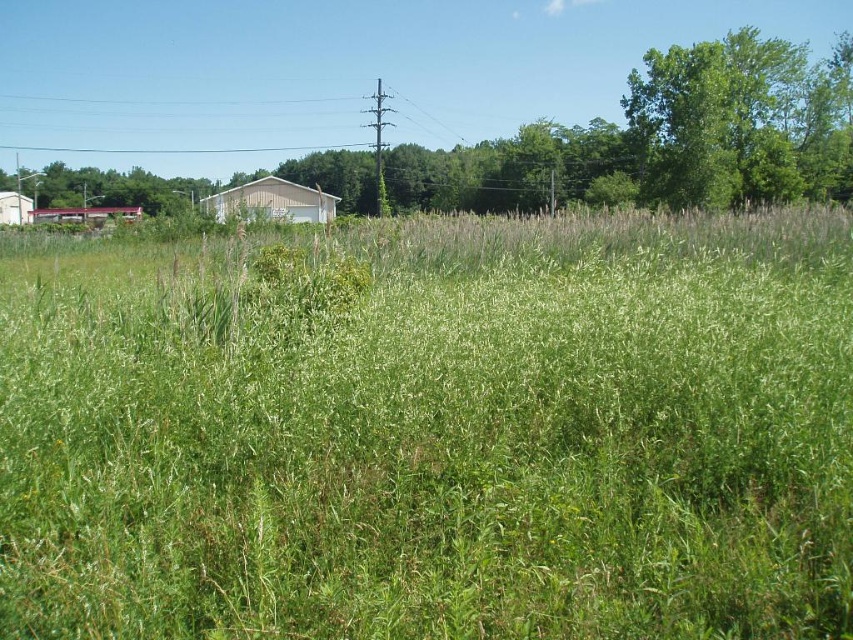
Between green leafy tree at upper right and green grassy field at left, which one appears on the right side from the viewer's perspective?

green leafy tree at upper right is more to the right.

Can you confirm if green leafy tree at upper right is taller than green grassy field at left?

Indeed, green leafy tree at upper right has a greater height compared to green grassy field at left.

What do you see at coordinates (741, 122) in the screenshot? The width and height of the screenshot is (853, 640). I see `green leafy tree at upper right` at bounding box center [741, 122].

Locate an element on the screen. The height and width of the screenshot is (640, 853). green leafy tree at upper right is located at coordinates (741, 122).

Is white matte barn at center wider than white wood hut at left?

Yes, white matte barn at center is wider than white wood hut at left.

Can you confirm if white matte barn at center is taller than white wood hut at left?

Correct, white matte barn at center is much taller as white wood hut at left.

Is point (277, 202) closer to camera compared to point (20, 205)?

Yes.

This screenshot has width=853, height=640. What are the coordinates of `white matte barn at center` in the screenshot? It's located at (271, 202).

Is green leafy tree at upper right shorter than metallic red hut at left?

No.

Is green leafy tree at upper right to the left of metallic red hut at left from the viewer's perspective?

In fact, green leafy tree at upper right is to the right of metallic red hut at left.

Is point (753, 48) positioned in front of point (56, 220)?

Yes, point (753, 48) is closer to viewer.

This screenshot has height=640, width=853. I want to click on green leafy tree at upper right, so click(741, 122).